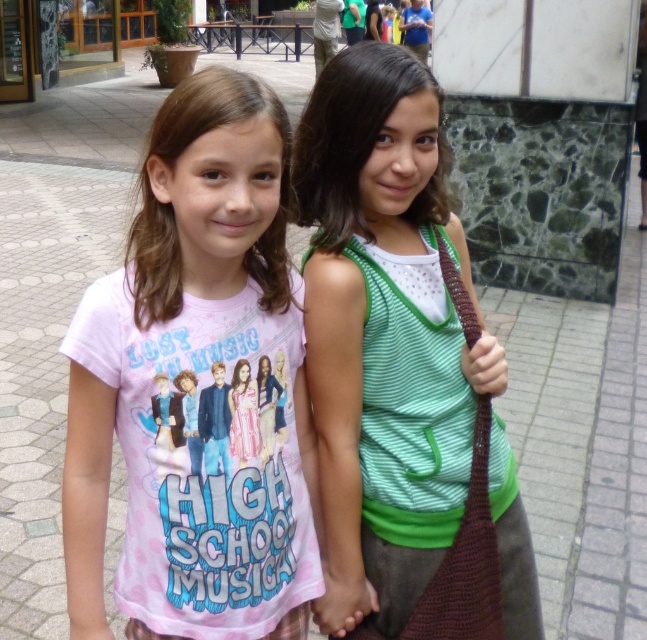
You are standing in a plaza and see two points marked in the image. The first point is at coordinates point [170,458] and the second point is at point [325,296]. Which point is closer to you?

Point [170,458] is closer to the viewer than point [325,296].